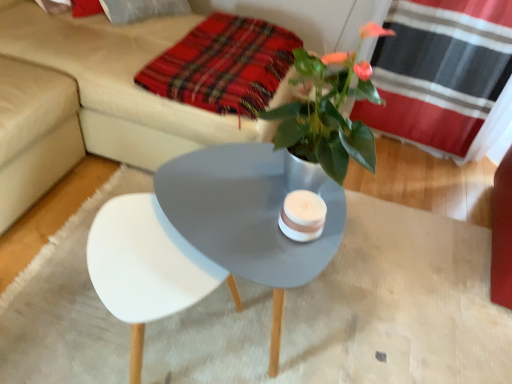
Question: Considering the positions of point [333, 178] and point [117, 155], is point [333, 178] closer or farther from the camera than point [117, 155]?

Choices:
 (A) closer
 (B) farther

Answer: (A)

Question: Relative to beige fabric couch at upper center, is metallic silver plant at center in front or behind?

Choices:
 (A) behind
 (B) front

Answer: (B)

Question: Estimate the real-world distances between objects in this image. Which object is closer to the beige fabric couch at upper center?

Choices:
 (A) metallic silver plant at center
 (B) plaid fabric at upper center

Answer: (B)

Question: Which object is the farthest from the beige fabric couch at upper center?

Choices:
 (A) plaid fabric at upper center
 (B) metallic silver plant at center

Answer: (B)